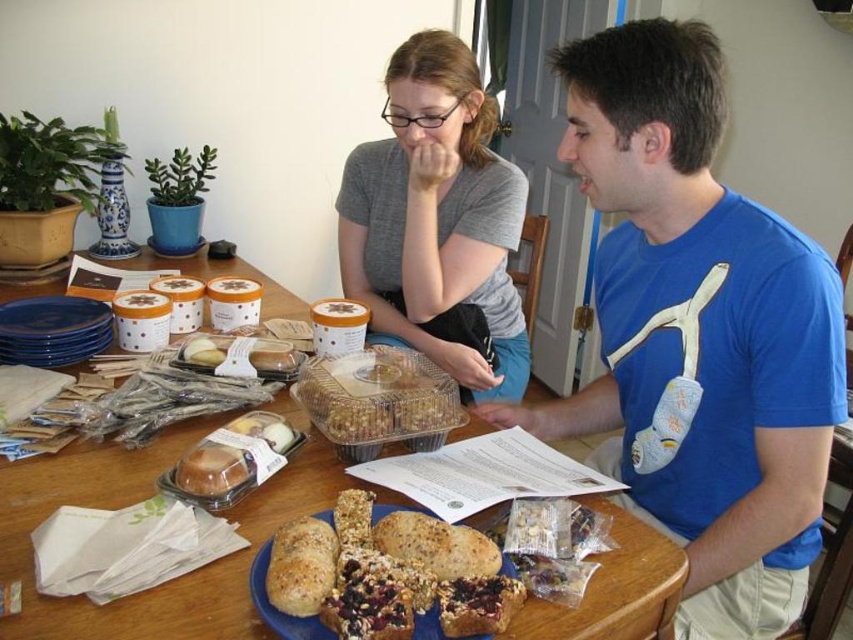
Question: Does blue cotton t-shirt at center have a lesser width compared to brown crumbly bread at center?

Choices:
 (A) no
 (B) yes

Answer: (A)

Question: Which point is closer to the camera taking this photo?

Choices:
 (A) (756, 566)
 (B) (256, 573)

Answer: (B)

Question: Is wooden table at center in front of crusty granola bar at center?

Choices:
 (A) yes
 (B) no

Answer: (B)

Question: Which object is positioned farthest from the blue cotton t-shirt at center?

Choices:
 (A) brown crumbly bread at center
 (B) translucent plastic container at center

Answer: (B)

Question: Estimate the real-world distances between objects in this image. Which object is farther from the wooden table at center?

Choices:
 (A) gray matte shirt at upper center
 (B) blue cotton t-shirt at center

Answer: (A)

Question: Is blue cotton t-shirt at center below gray matte shirt at upper center?

Choices:
 (A) no
 (B) yes

Answer: (B)